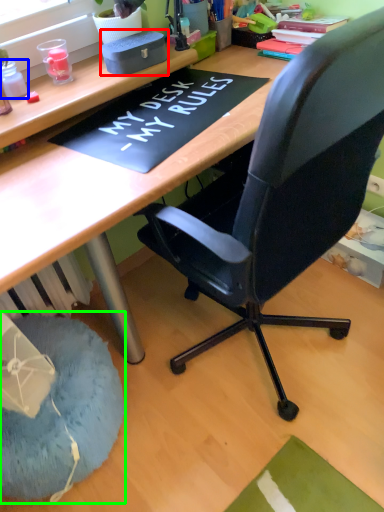
Question: Considering the real-world distances, which object is farthest from stationery (highlighted by a red box)? stationery (highlighted by a blue box) or bean bag chair (highlighted by a green box)?

Choices:
 (A) stationery
 (B) bean bag chair

Answer: (B)